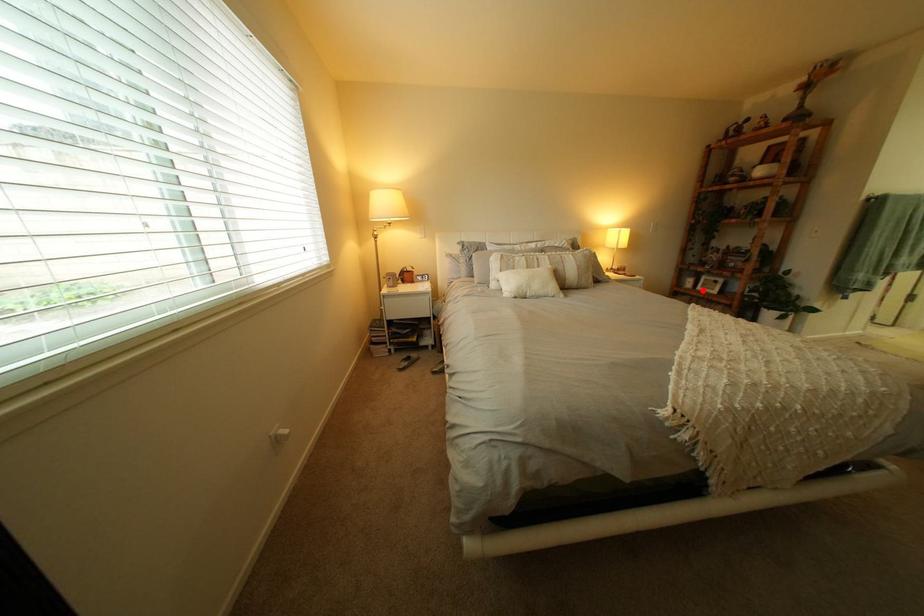
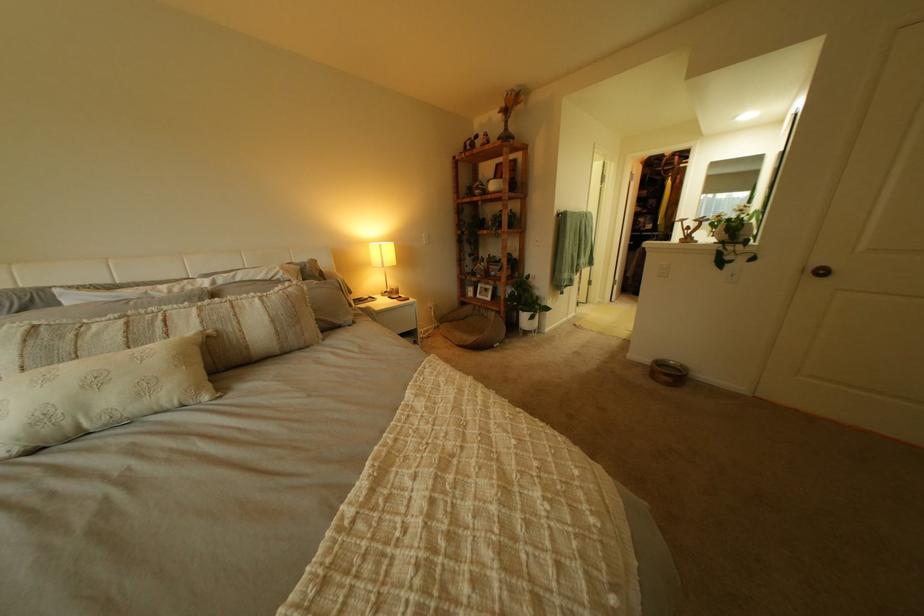
In the second image, find the point that corresponds to the highlighted location in the first image.

(485, 300)